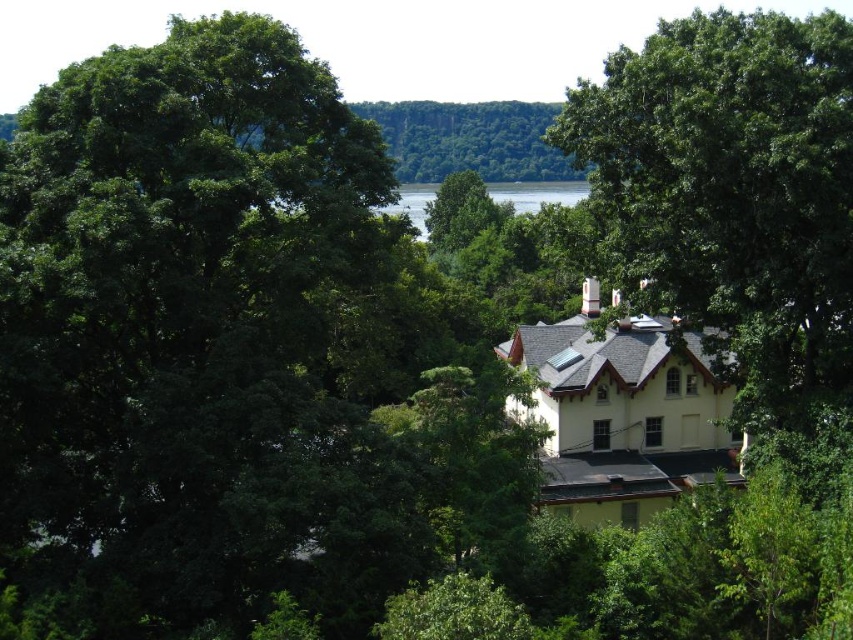
In the scene shown: You are standing at the point labeled as point (732, 195) in the image. Looking around, you see a green leafy tree at center. Which direction should you face to see the green leafy tree at center?

The point (732, 195) is located at the green leafy tree at center, so you are already facing it.

You are planning to plant a new tree in your backyard. You have a green leafy tree at center and a green water at center. Which one has a smaller width?

The green leafy tree at center is thinner than green water at center, so the green leafy tree at center has a smaller width.

You are a bird flying over the landscape and want to land on the green leafy tree at center. To avoid the green water at center, which direction should you turn from the tree?

The green leafy tree at center is positioned on the right side of green water at center. To avoid the water, you should turn left from the tree.